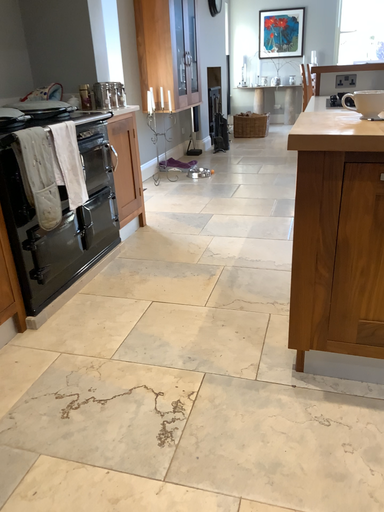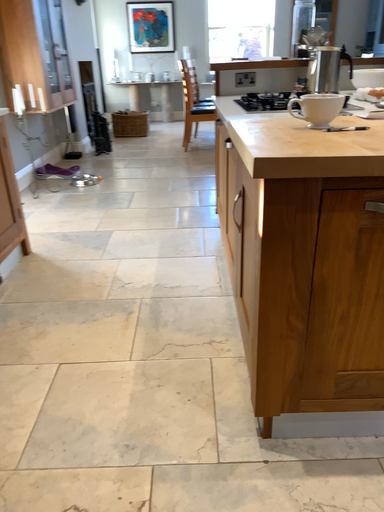
Question: How did the camera likely rotate when shooting the video?

Choices:
 (A) rotated left
 (B) rotated right

Answer: (B)